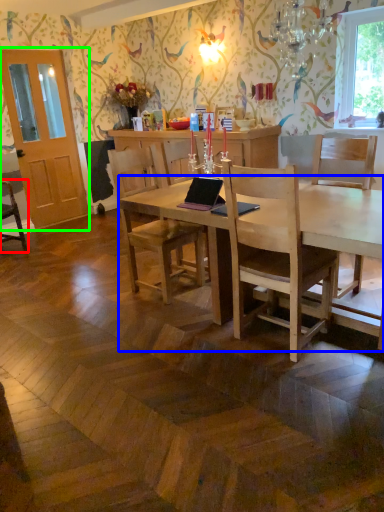
Question: Which object is the farthest from chair (highlighted by a red box)? Choose among these: desk (highlighted by a blue box) or glass door (highlighted by a green box).

Choices:
 (A) desk
 (B) glass door

Answer: (A)